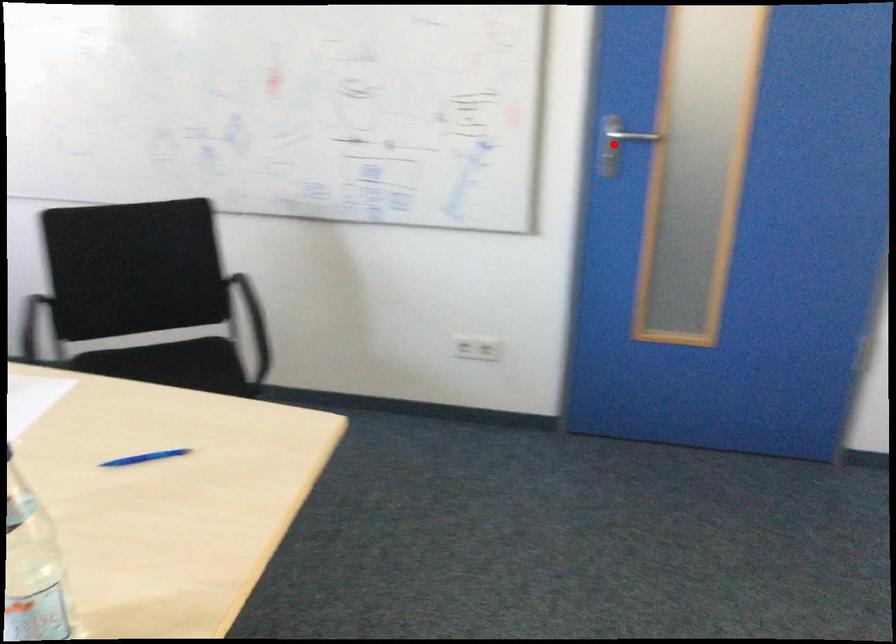
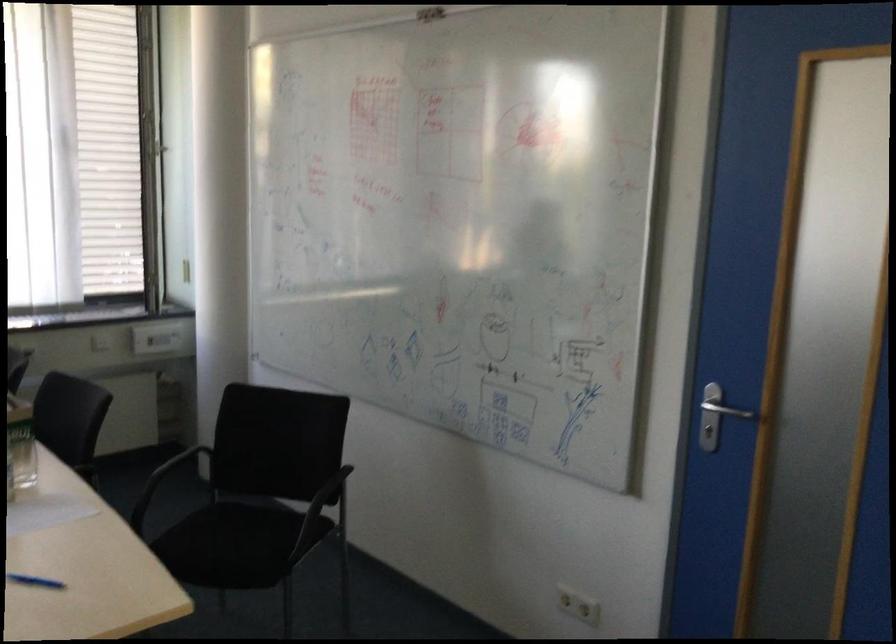
Locate, in the second image, the point that corresponds to the highlighted location in the first image.

(716, 415)